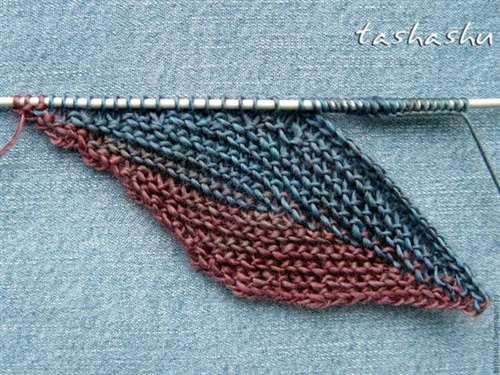
At what (x,y) coordinates should I click in order to perform the action: click on yarn looped on knitting needle. Please return your answer as a coordinate pair (x, y). Looking at the image, I should click on click(33, 103), click(65, 101), click(157, 101), click(246, 101), click(388, 106), click(438, 105).